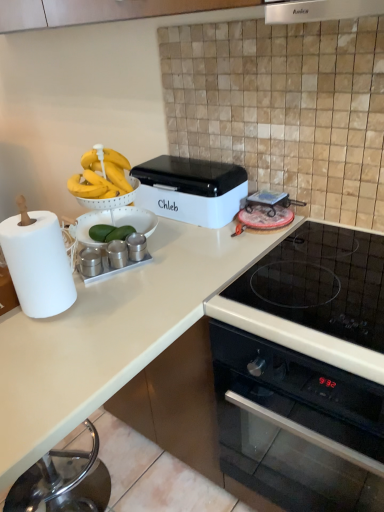
Question: From a real-world perspective, is black glass oven at lower right below white matte countertop at lower left?

Choices:
 (A) no
 (B) yes

Answer: (A)

Question: Considering the relative sizes of black glass oven at lower right and white matte countertop at lower left in the image provided, is black glass oven at lower right thinner than white matte countertop at lower left?

Choices:
 (A) yes
 (B) no

Answer: (A)

Question: From a real-world perspective, is black glass oven at lower right physically above white matte countertop at lower left?

Choices:
 (A) no
 (B) yes

Answer: (B)

Question: Is there a large distance between black glass oven at lower right and white matte countertop at lower left?

Choices:
 (A) yes
 (B) no

Answer: (B)

Question: Does black glass oven at lower right have a lesser height compared to white matte countertop at lower left?

Choices:
 (A) no
 (B) yes

Answer: (B)

Question: From the image's perspective, does black glass oven at lower right appear lower than white matte countertop at lower left?

Choices:
 (A) yes
 (B) no

Answer: (B)

Question: From the image's perspective, is black glass oven at lower right above white paper at left?

Choices:
 (A) no
 (B) yes

Answer: (A)

Question: Can you confirm if black glass oven at lower right is shorter than white paper at left?

Choices:
 (A) yes
 (B) no

Answer: (B)

Question: From a real-world perspective, is black glass oven at lower right located higher than white paper at left?

Choices:
 (A) no
 (B) yes

Answer: (A)

Question: Is black glass oven at lower right thinner than white paper at left?

Choices:
 (A) yes
 (B) no

Answer: (B)

Question: From a real-world perspective, is black glass oven at lower right located beneath white paper at left?

Choices:
 (A) yes
 (B) no

Answer: (A)

Question: Can you confirm if black glass oven at lower right is smaller than white paper at left?

Choices:
 (A) no
 (B) yes

Answer: (A)

Question: Is white plastic bread bin at center smaller than satin silver exhaust hood at upper center?

Choices:
 (A) no
 (B) yes

Answer: (A)